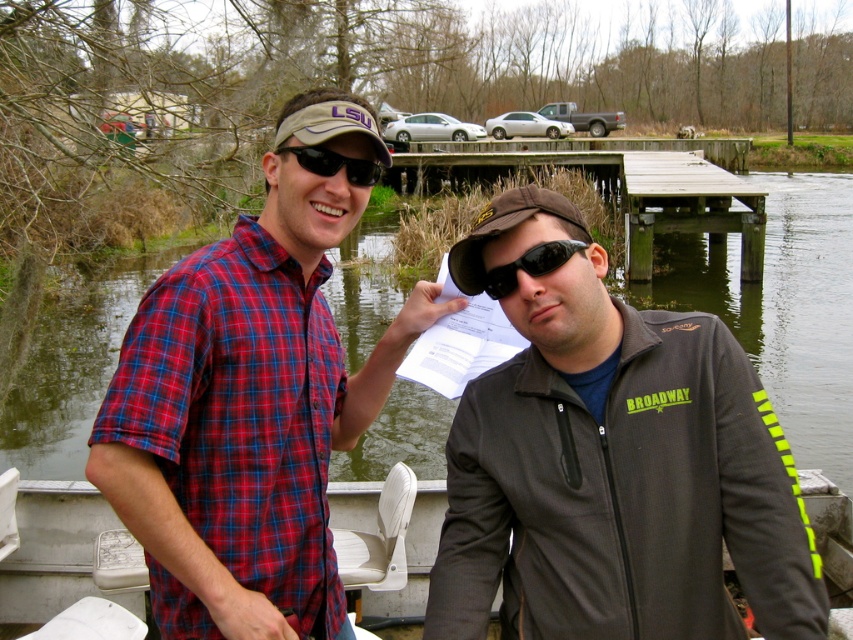
Question: Observing the image, what is the correct spatial positioning of metallic gray boat at lower center in reference to wooden at center?

Choices:
 (A) below
 (B) above

Answer: (A)

Question: Estimate the real-world distances between objects in this image. Which object is farther from the black plastic goggles at center?

Choices:
 (A) green water at lower left
 (B) dark gray softshell jacket at center
 (C) matte fabric baseball cap at upper center
 (D) brown fabric baseball cap at center

Answer: (A)

Question: Does dark gray softshell jacket at center lie behind matte fabric baseball cap at upper center?

Choices:
 (A) yes
 (B) no

Answer: (B)

Question: Is matte fabric baseball cap at upper center to the left of black matte sunglasses at center from the viewer's perspective?

Choices:
 (A) yes
 (B) no

Answer: (B)

Question: Among these objects, which one is nearest to the camera?

Choices:
 (A) dark gray softshell jacket at center
 (B) metallic gray boat at lower center
 (C) green water at lower left

Answer: (A)

Question: Estimate the real-world distances between objects in this image. Which object is farther from the black plastic goggles at center?

Choices:
 (A) plaid cotton shirt at center
 (B) brown fabric baseball cap at center
 (C) green water at lower left
 (D) black matte sunglasses at center

Answer: (C)